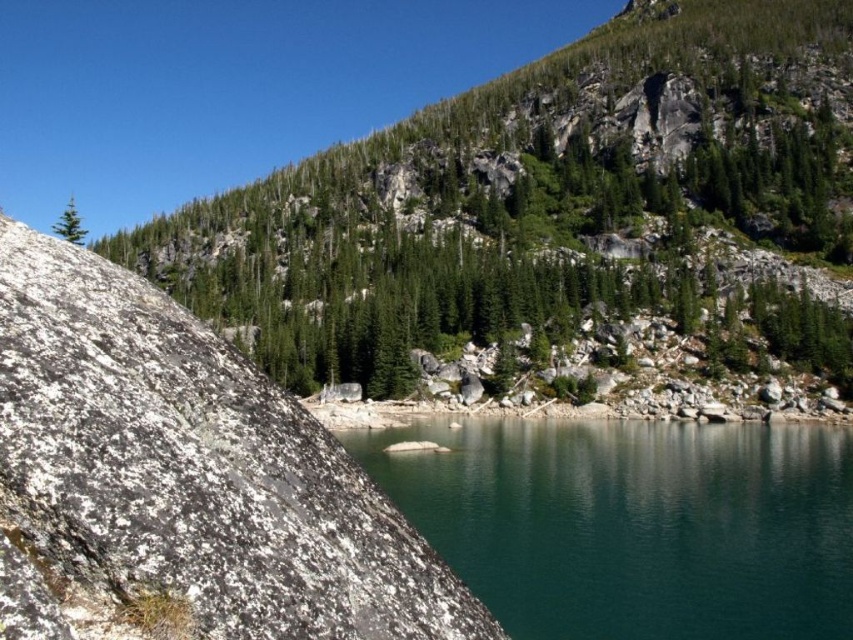
Question: Among these objects, which one is farthest from the camera?

Choices:
 (A) green textured rock at center
 (B) teal glassy water at center
 (C) green matte tree at upper left

Answer: (A)

Question: Which point is farther from the camera taking this photo?

Choices:
 (A) 212,451
 (B) 706,572

Answer: (B)

Question: Does green textured rock at center appear under green matte tree at upper left?

Choices:
 (A) yes
 (B) no

Answer: (B)

Question: Which point is closer to the camera taking this photo?

Choices:
 (A) (804, 512)
 (B) (439, 275)

Answer: (A)

Question: Is white speckled rock at center wider than green matte tree at upper left?

Choices:
 (A) yes
 (B) no

Answer: (B)

Question: Does white speckled rock at center appear over green matte tree at upper left?

Choices:
 (A) no
 (B) yes

Answer: (A)